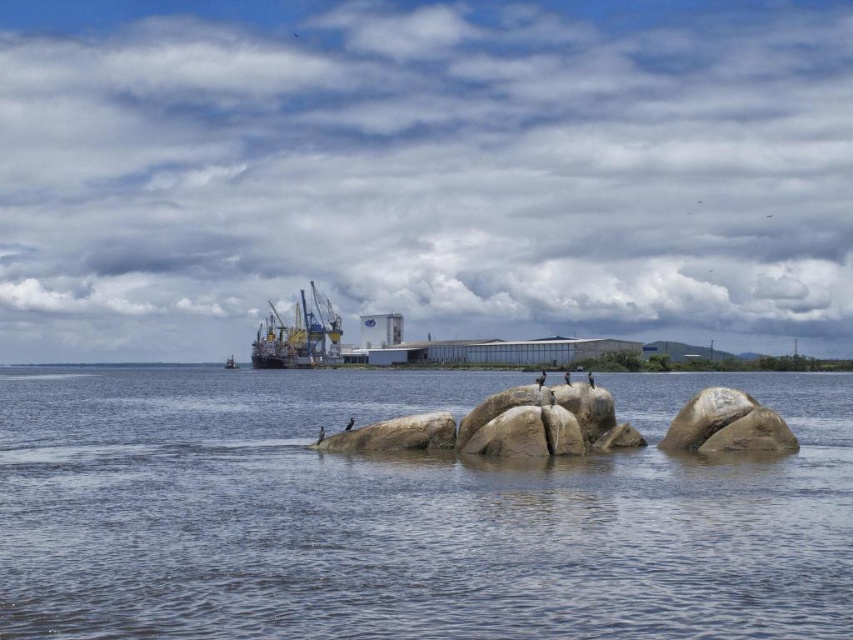
Question: Which point appears farthest from the camera in this image?

Choices:
 (A) (334, 316)
 (B) (229, 368)
 (C) (727, 580)

Answer: (B)

Question: Is metallic gray ship at center above metallic gray boat at center?

Choices:
 (A) no
 (B) yes

Answer: (B)

Question: Which of the following is the closest to the observer?

Choices:
 (A) (155, 392)
 (B) (227, 362)
 (C) (328, 326)

Answer: (A)

Question: Estimate the real-world distances between objects in this image. Which object is closer to the clear water at center?

Choices:
 (A) metallic gray boat at center
 (B) metallic gray ship at center

Answer: (B)

Question: Can you confirm if clear water at center is bigger than metallic gray ship at center?

Choices:
 (A) yes
 (B) no

Answer: (A)

Question: Does clear water at center appear on the right side of metallic gray boat at center?

Choices:
 (A) yes
 (B) no

Answer: (A)